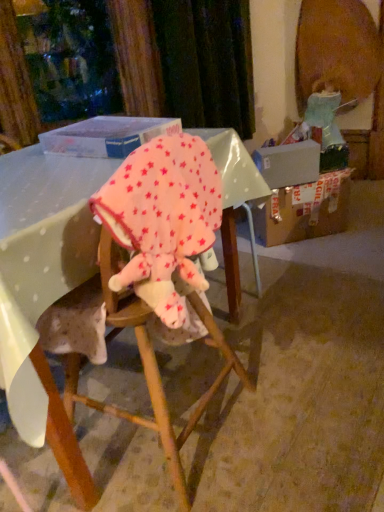
Locate an element on the screen. The height and width of the screenshot is (512, 384). vacant space in front of brown cardboard box at right is located at coordinates (324, 253).